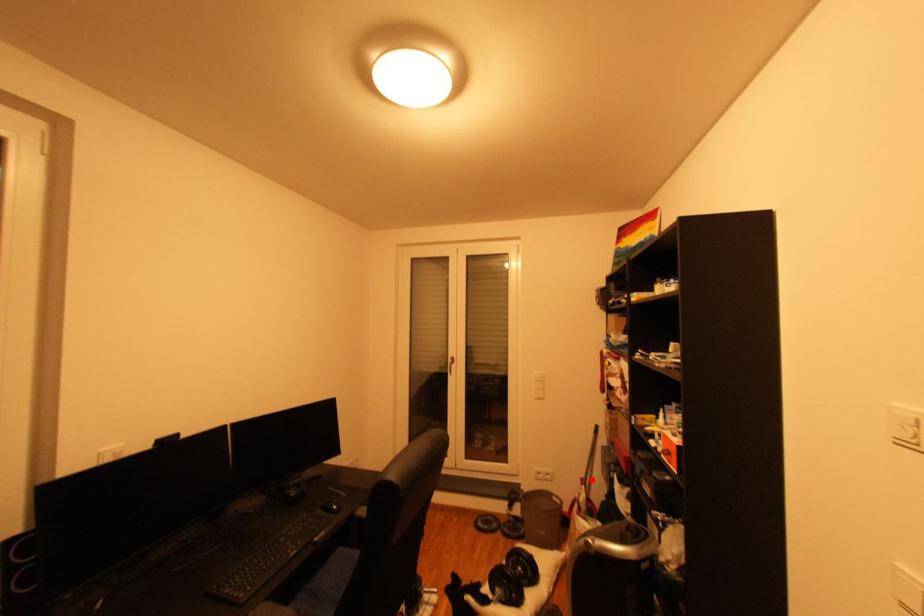
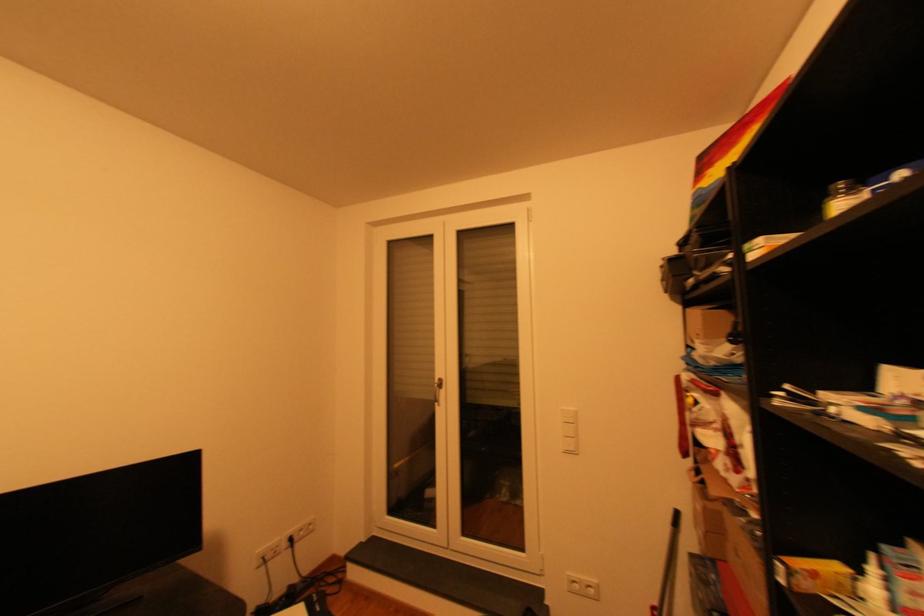
Question: I am providing you with two images of the same scene from different viewpoints. A red point is marked on the first image. Can you still see the location of the red point in image 2?

Choices:
 (A) Yes
 (B) No

Answer: (A)